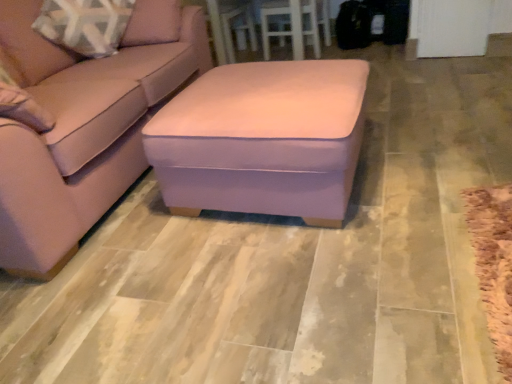
Question: Is pink velvet ottoman at center inside or outside of white wood table at upper center?

Choices:
 (A) outside
 (B) inside

Answer: (A)

Question: Looking at the image, does pink velvet ottoman at center seem bigger or smaller compared to white wood table at upper center?

Choices:
 (A) small
 (B) big

Answer: (A)

Question: Considering the real-world distances, which object is closest to the suede pink ottoman at center?

Choices:
 (A) white wood table at upper center
 (B) pink velvet ottoman at center

Answer: (B)

Question: Considering the real-world distances, which object is closest to the suede pink ottoman at center?

Choices:
 (A) pink velvet ottoman at center
 (B) white wood table at upper center

Answer: (A)